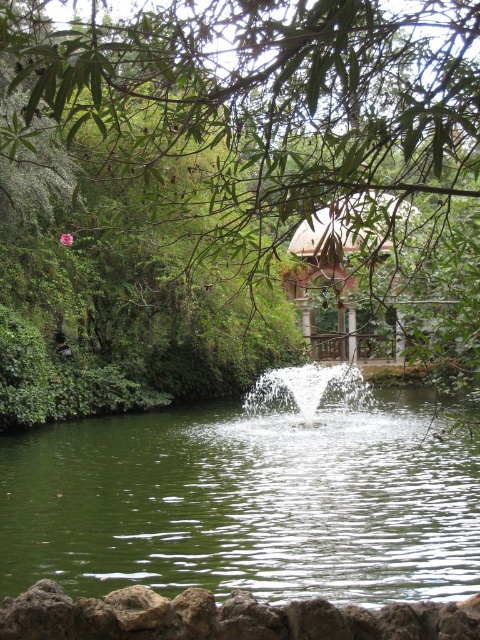
Question: Does green liquid water at center come behind wooden gazebo at center?

Choices:
 (A) no
 (B) yes

Answer: (B)

Question: Which of the following is the closest to the observer?

Choices:
 (A) (215, 108)
 (B) (352, 340)

Answer: (A)

Question: Which object is the closest to the wooden gazebo at center?

Choices:
 (A) green liquid water at center
 (B) green leafy tree at center

Answer: (B)

Question: Does green leafy tree at center lie in front of green liquid water at center?

Choices:
 (A) no
 (B) yes

Answer: (B)

Question: Which of the following is the farthest from the observer?

Choices:
 (A) (189, 580)
 (B) (290, 273)

Answer: (B)

Question: Is green liquid water at center to the left of wooden gazebo at center from the viewer's perspective?

Choices:
 (A) no
 (B) yes

Answer: (B)